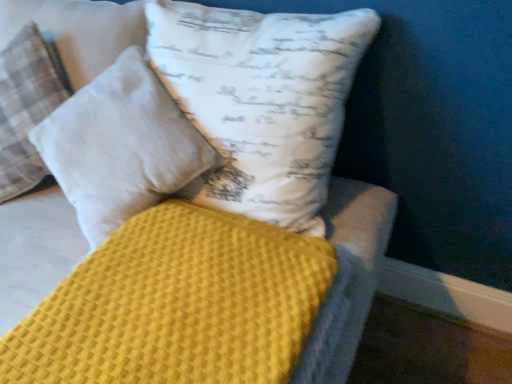
Question: Based on their positions, is white cotton pillow at upper center, which is counted as the 1th pillow, starting from the right, located to the left or right of yellow waffle-textured mattress at center?

Choices:
 (A) right
 (B) left

Answer: (B)

Question: Considering the positions of white cotton pillow at upper center, which is counted as the second pillow, starting from the left, and yellow waffle-textured mattress at center in the image, is white cotton pillow at upper center, which is counted as the second pillow, starting from the left, taller or shorter than yellow waffle-textured mattress at center?

Choices:
 (A) short
 (B) tall

Answer: (B)

Question: Estimate the real-world distances between objects in this image. Which object is farther from the yellow waffle-textured mattress at center?

Choices:
 (A) white cotton pillow at upper center, which is counted as the 1th pillow, starting from the right
 (B) white cotton pillow at upper left, the second pillow viewed from the right

Answer: (B)

Question: Considering the real-world distances, which object is closest to the white cotton pillow at upper center, which is counted as the second pillow, starting from the left?

Choices:
 (A) yellow waffle-textured mattress at center
 (B) white cotton pillow at upper left, placed as the first pillow when sorted from left to right

Answer: (B)